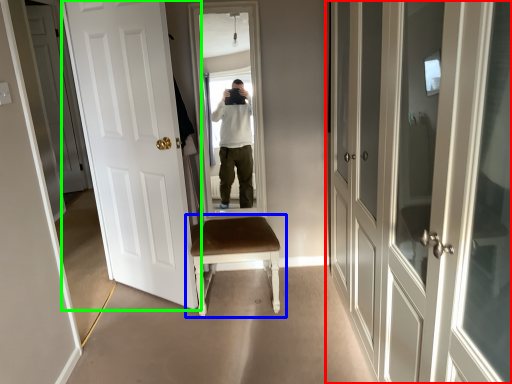
Question: Considering the real-world distances, which object is farthest from door (highlighted by a red box)? chair (highlighted by a blue box) or door (highlighted by a green box)?

Choices:
 (A) chair
 (B) door

Answer: (B)